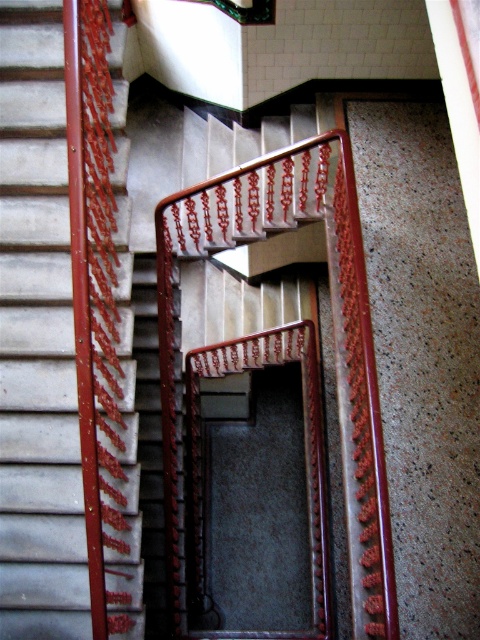
Question: Is metallic red handrail at left above polished wood handrail at center?

Choices:
 (A) yes
 (B) no

Answer: (A)

Question: Can you confirm if metallic red handrail at left is positioned above polished wood handrail at center?

Choices:
 (A) yes
 (B) no

Answer: (A)

Question: Which object is closer to the camera taking this photo?

Choices:
 (A) polished wood handrail at center
 (B) metallic red handrail at left

Answer: (B)

Question: Which object is farther from the camera taking this photo?

Choices:
 (A) metallic red handrail at left
 (B) polished wood handrail at center

Answer: (B)

Question: Among these objects, which one is nearest to the camera?

Choices:
 (A) metallic red handrail at left
 (B) polished wood handrail at center

Answer: (A)

Question: Can you confirm if metallic red handrail at left is positioned to the right of polished wood handrail at center?

Choices:
 (A) yes
 (B) no

Answer: (B)